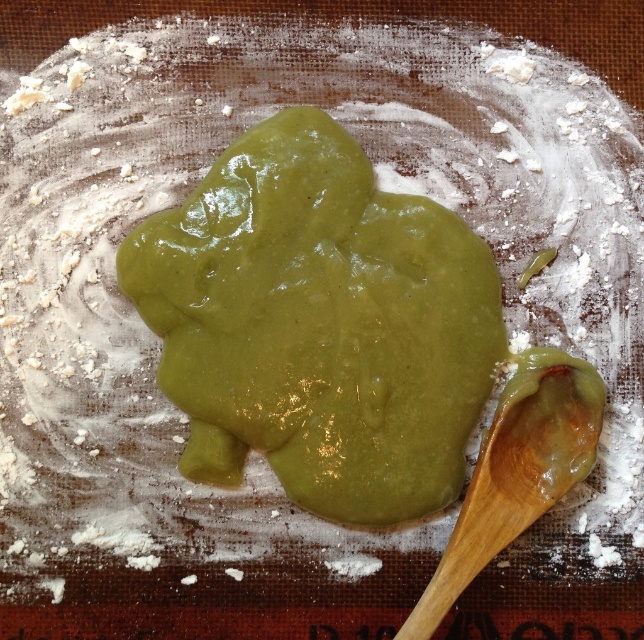
Question: Is green glossy paste at center behind wooden spoon at lower right?

Choices:
 (A) yes
 (B) no

Answer: (A)

Question: Is green glossy paste at center thinner than wooden spoon at lower right?

Choices:
 (A) no
 (B) yes

Answer: (A)

Question: Can you confirm if green glossy paste at center is wider than wooden spoon at lower right?

Choices:
 (A) yes
 (B) no

Answer: (A)

Question: Which point appears closest to the camera in this image?

Choices:
 (A) (426, 588)
 (B) (345, 189)

Answer: (A)

Question: Which object appears farthest from the camera in this image?

Choices:
 (A) green glossy paste at center
 (B) wooden spoon at lower right

Answer: (A)